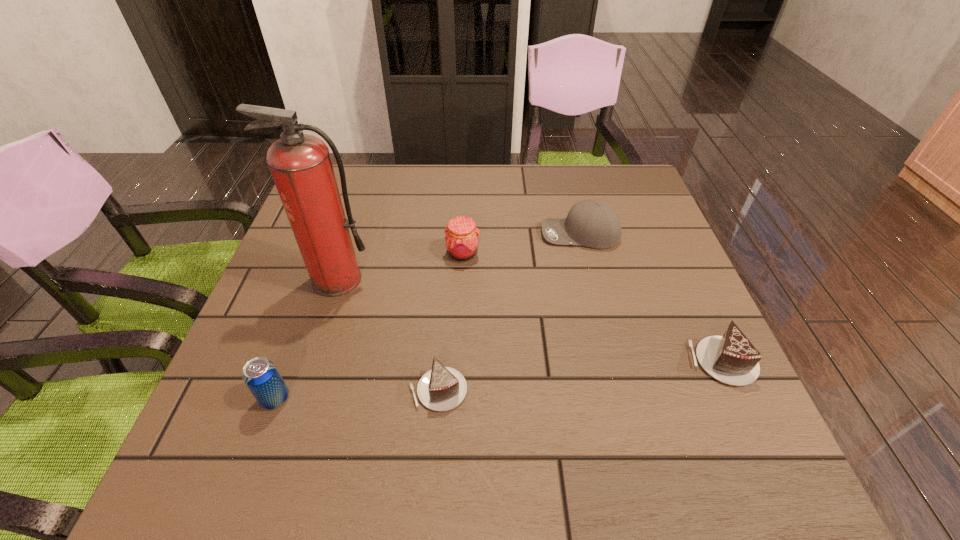
I want to click on vacant space that satisfies the following two spatial constraints: 1. on the back side of the left chocolate cake; 2. on the right side of the beer can, so click(278, 390).